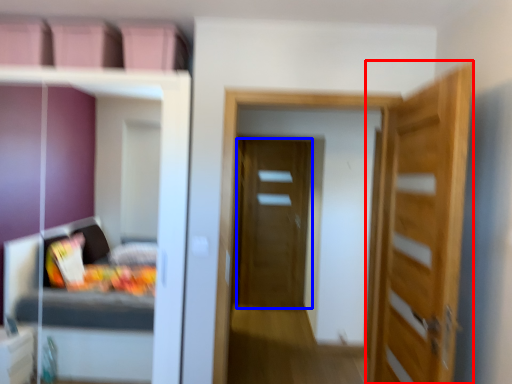
Question: Which object is further to the camera taking this photo, door (highlighted by a red box) or door (highlighted by a blue box)?

Choices:
 (A) door
 (B) door

Answer: (B)